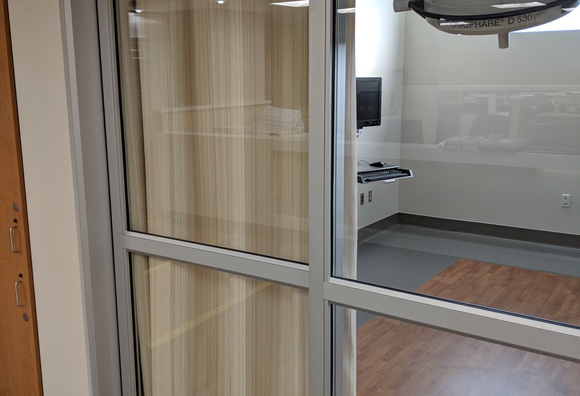
The height and width of the screenshot is (396, 580). Find the location of `computer screen`. computer screen is located at coordinates (362, 93).